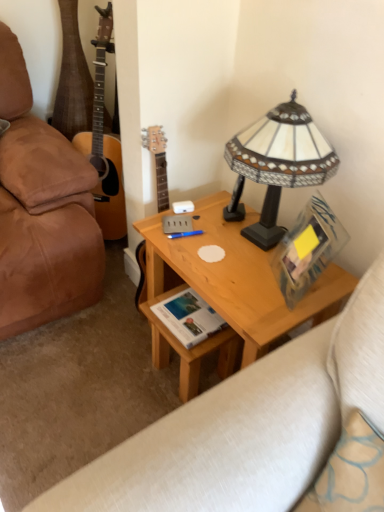
Where is `vacant area situated below stained glass lampshade at upper right (from a real-world perspective)`? vacant area situated below stained glass lampshade at upper right (from a real-world perspective) is located at coordinates (261, 239).